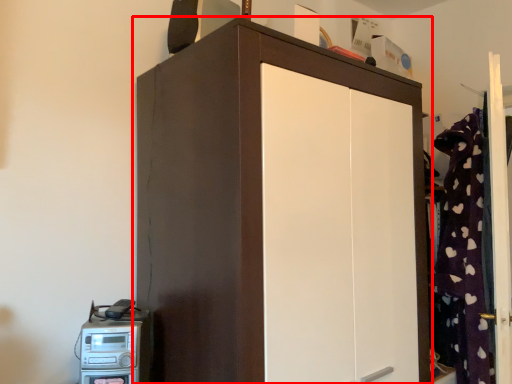
Question: From the image's perspective, what is the correct spatial relationship of cupboard (annotated by the red box) in relation to home appliance?

Choices:
 (A) above
 (B) below

Answer: (A)